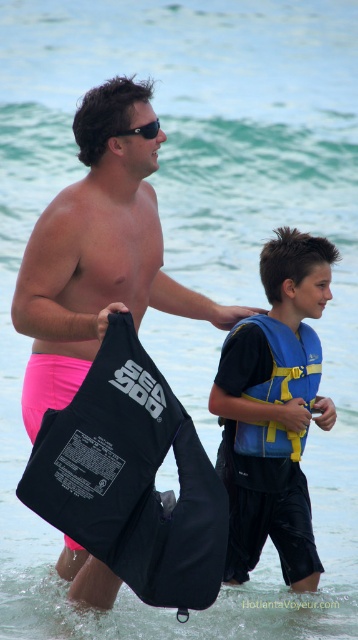
Question: Is blue/yellow life vest at center to the right of blue/yellow life jacket at center from the viewer's perspective?

Choices:
 (A) yes
 (B) no

Answer: (B)

Question: Can you confirm if pink fabric shorts at center is bigger than black plastic sunglasses at upper center?

Choices:
 (A) no
 (B) yes

Answer: (B)

Question: Which of the following is the farthest from the observer?

Choices:
 (A) (242, 385)
 (B) (157, 124)
 (C) (25, 420)

Answer: (A)

Question: Estimate the real-world distances between objects in this image. Which object is farther from the pink fabric shorts at center?

Choices:
 (A) black plastic sunglasses at upper center
 (B) blue/yellow life jacket at center

Answer: (A)

Question: Which object is closer to the camera taking this photo?

Choices:
 (A) blue/yellow life vest at center
 (B) black plastic sunglasses at upper center

Answer: (B)

Question: Does blue/yellow life jacket at center lie in front of black plastic sunglasses at upper center?

Choices:
 (A) yes
 (B) no

Answer: (B)